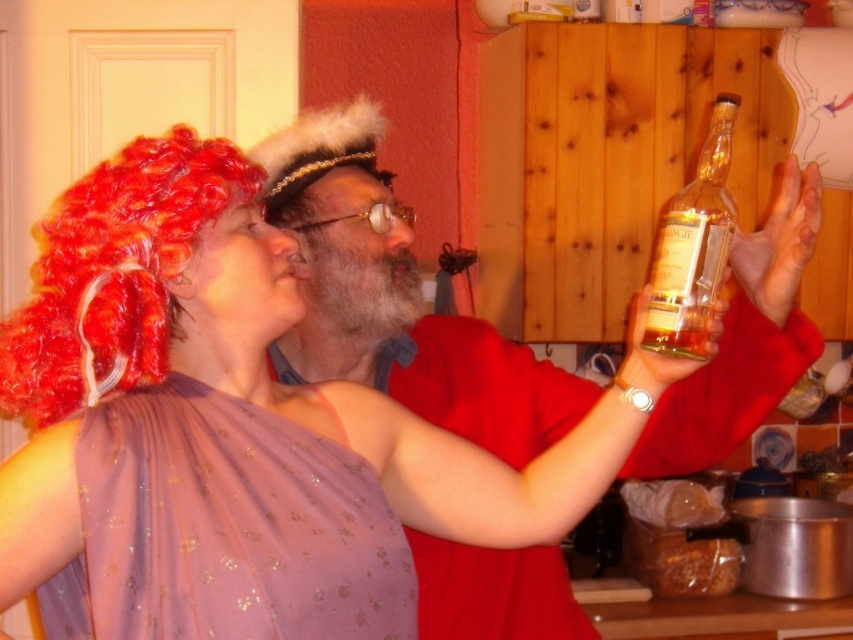
From the picture: Can you confirm if matte glass bottle at upper right is positioned to the right of purple satin dress at upper left?

Correct, you'll find matte glass bottle at upper right to the right of purple satin dress at upper left.

Does point (540, 364) come closer to viewer compared to point (144, 460)?

No, (540, 364) is further to viewer.

Where is `matte glass bottle at upper right`? The image size is (853, 640). matte glass bottle at upper right is located at coordinates (395, 298).

Who is positioned more to the right, purple satin dress at upper left or clear glass bottle at upper right?

Positioned to the right is clear glass bottle at upper right.

Describe the element at coordinates (225, 529) in the screenshot. This screenshot has height=640, width=853. I see `purple satin dress at upper left` at that location.

Does point (157, 522) come closer to viewer compared to point (680, 273)?

Yes, it is.

The image size is (853, 640). I want to click on purple satin dress at upper left, so click(225, 529).

Which is more to the left, matte glass bottle at upper right or clear glass bottle at upper right?

matte glass bottle at upper right is more to the left.

Does matte glass bottle at upper right have a lesser height compared to clear glass bottle at upper right?

Incorrect, matte glass bottle at upper right's height does not fall short of clear glass bottle at upper right's.

Locate an element on the screen. This screenshot has height=640, width=853. matte glass bottle at upper right is located at coordinates (395, 298).

At what (x,y) coordinates should I click in order to perform the action: click on matte glass bottle at upper right. Please return your answer as a coordinate pair (x, y). The height and width of the screenshot is (640, 853). Looking at the image, I should click on (395, 298).